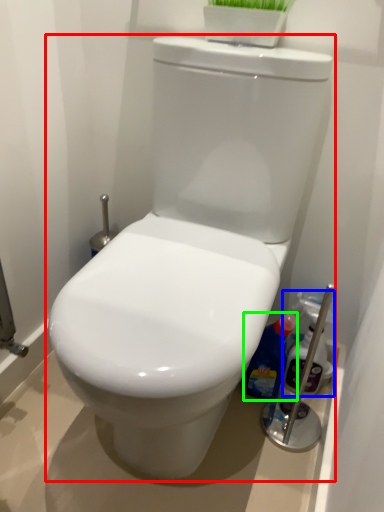
Question: Which object is the farthest from toilet (highlighted by a red box)? Choose among these: cleaning product (highlighted by a blue box) or cleaning product (highlighted by a green box).

Choices:
 (A) cleaning product
 (B) cleaning product

Answer: (A)